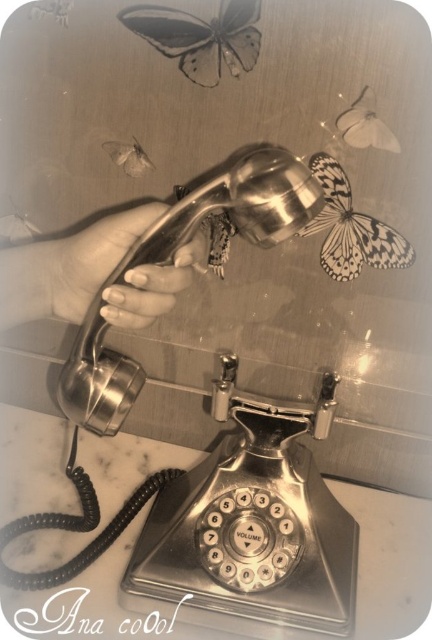
Which is more to the left, white matte butterfly at upper right or white matte butterfly at upper left?

Positioned to the left is white matte butterfly at upper left.

Does point (352, 124) lie behind point (139, 166)?

No, it is not.

Who is more distant from viewer, (337, 115) or (145, 152)?

Point (145, 152)

The image size is (432, 640). I want to click on white matte butterfly at upper right, so click(x=365, y=124).

Is translucent paper butterfly at upper center to the left of white matte butterfly at upper left from the viewer's perspective?

No, translucent paper butterfly at upper center is not to the left of white matte butterfly at upper left.

The width and height of the screenshot is (432, 640). I want to click on translucent paper butterfly at upper center, so click(200, 36).

Does point (219, 77) come in front of point (146, 170)?

Yes, point (219, 77) is closer to viewer.

Image resolution: width=432 pixels, height=640 pixels. In order to click on translucent paper butterfly at upper center in this screenshot , I will do `click(200, 36)`.

Between silver metallic hand at center and white matte butterfly at upper left, which one has less height?

white matte butterfly at upper left

Does point (168, 296) lie in front of point (140, 173)?

Yes, point (168, 296) is closer to viewer.

Find the location of a particular element. This screenshot has width=432, height=640. silver metallic hand at center is located at coordinates pyautogui.click(x=94, y=257).

Locate an element on the screen. silver metallic hand at center is located at coordinates (94, 257).